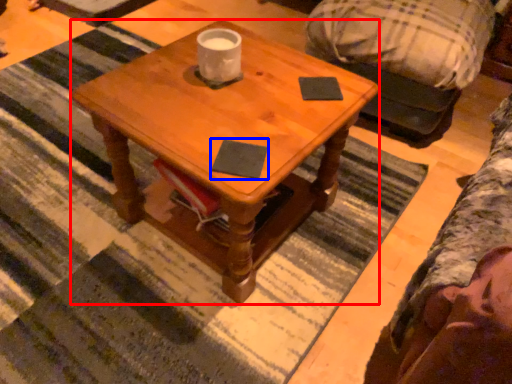
Question: Which object appears closest to the camera in this image, coffee table (highlighted by a red box) or notepad (highlighted by a blue box)?

Choices:
 (A) coffee table
 (B) notepad

Answer: (A)